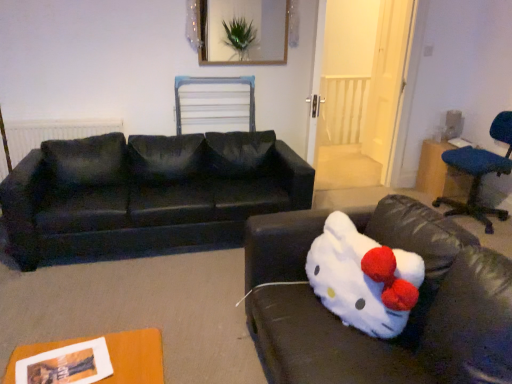
I want to click on blue fabric table at right, so click(440, 173).

Describe the element at coordinates (409, 318) in the screenshot. I see `white plush toy at lower right, the second studio couch in the back-to-front sequence` at that location.

At what (x,y) coordinates should I click in order to perform the action: click on wooden picture frame at upper center. Please return your answer as a coordinate pair (x, y). This screenshot has height=384, width=512. Looking at the image, I should click on (248, 23).

Is white plush toy at lower right beside wooden picture frame at upper center?

white plush toy at lower right and wooden picture frame at upper center are not in contact.

Where is `picture frame above the white plush toy at lower right (from the image's perspective)`? picture frame above the white plush toy at lower right (from the image's perspective) is located at coordinates (248, 23).

Is white plush toy at lower right located outside wooden picture frame at upper center?

Indeed, white plush toy at lower right is completely outside wooden picture frame at upper center.

Is point (404, 281) closer to viewer compared to point (213, 13)?

Yes.

Is matte black radiator at left far from blue fabric table at right?

matte black radiator at left is far away from blue fabric table at right.

Considering the points (35, 133) and (422, 186), which point is in front, point (35, 133) or point (422, 186)?

The point (35, 133) is closer.

Based on the photo, from the image's perspective, is matte black radiator at left located beneath blue fabric table at right?

No, from the image's perspective, matte black radiator at left is not below blue fabric table at right.

How distant is white plush toy at lower right from matte black radiator at left?

A distance of 7.43 feet exists between white plush toy at lower right and matte black radiator at left.

From the image's perspective, is white plush toy at lower right above matte black radiator at left?

Actually, white plush toy at lower right appears below matte black radiator at left in the image.

Looking at this image, is white plush toy at lower right far away from matte black radiator at left?

Absolutely, white plush toy at lower right is distant from matte black radiator at left.

Is white plush toy at lower right to the left or to the right of matte black radiator at left in the image?

From the image, it's evident that white plush toy at lower right is to the right of matte black radiator at left.

Considering the points (342, 290) and (287, 164), which point is behind, point (342, 290) or point (287, 164)?

Positioned behind is point (287, 164).

Locate an element on the screen. This screenshot has width=512, height=384. animal below the black fabric couch at left, the second studio couch viewed from the front (from the image's perspective) is located at coordinates (362, 278).

Between white plush toy at lower right and black fabric couch at left, the first studio couch positioned from the back, which one appears on the left side from the viewer's perspective?

black fabric couch at left, the first studio couch positioned from the back, is more to the left.

How many degrees apart are the facing directions of white plush toy at lower right and black fabric couch at left, the second studio couch viewed from the front?

They differ by 79.7 degrees in their facing directions.

Between white plush toy at lower right, arranged as the 1th studio couch when viewed from the front, and blue fabric table at right, which one has less height?

blue fabric table at right is shorter.

From a real-world perspective, is white plush toy at lower right, arranged as the 1th studio couch when viewed from the front, under blue fabric table at right?

No, from a real-world perspective, white plush toy at lower right, arranged as the 1th studio couch when viewed from the front, is not beneath blue fabric table at right.

Could you tell me if white plush toy at lower right, arranged as the 1th studio couch when viewed from the front, is turned towards blue fabric table at right?

No, white plush toy at lower right, arranged as the 1th studio couch when viewed from the front, is not facing towards blue fabric table at right.

From the image's perspective, is white plush toy at lower right, the second studio couch in the back-to-front sequence, below blue fabric table at right?

Yes.

Does wooden picture frame at upper center have a greater height compared to black fabric couch at left, the second studio couch viewed from the front?

Incorrect, the height of wooden picture frame at upper center is not larger of that of black fabric couch at left, the second studio couch viewed from the front.

From the picture: Based on their positions, is wooden picture frame at upper center located to the left or right of black fabric couch at left, the first studio couch positioned from the back?

Based on their positions, wooden picture frame at upper center is located to the right of black fabric couch at left, the first studio couch positioned from the back.

Who is more distant, wooden picture frame at upper center or black fabric couch at left, the first studio couch positioned from the back?

wooden picture frame at upper center.

From a real-world perspective, who is located lower, wooden picture frame at upper center or black fabric couch at left, the first studio couch positioned from the back?

black fabric couch at left, the first studio couch positioned from the back.

Who is taller, matte black radiator at left or black fabric couch at left, the second studio couch viewed from the front?

With more height is black fabric couch at left, the second studio couch viewed from the front.

Where is `the 2nd studio couch directly beneath the matte black radiator at left (from a real-world perspective)`? The width and height of the screenshot is (512, 384). the 2nd studio couch directly beneath the matte black radiator at left (from a real-world perspective) is located at coordinates (147, 193).

How many degrees apart are the facing directions of matte black radiator at left and black fabric couch at left, the second studio couch viewed from the front?

The angular difference between matte black radiator at left and black fabric couch at left, the second studio couch viewed from the front, is 1.44 degrees.

Is matte black radiator at left not within black fabric couch at left, the first studio couch positioned from the back?

That's correct, matte black radiator at left is outside of black fabric couch at left, the first studio couch positioned from the back.

Locate an element on the screen. The image size is (512, 384). picture frame above the white plush toy at lower right (from a real-world perspective) is located at coordinates (248, 23).

Find the location of a particular element. table that appears on the right of matte black radiator at left is located at coordinates (440, 173).

Which object lies nearer to the anchor point white plush toy at lower right, the second studio couch in the back-to-front sequence, wooden picture frame at upper center or blue fabric chair at right?

blue fabric chair at right is positioned closer to the anchor white plush toy at lower right, the second studio couch in the back-to-front sequence.

Considering their positions, is white plush toy at lower right, the second studio couch in the back-to-front sequence, positioned further to wooden picture frame at upper center than matte black radiator at left?

white plush toy at lower right, the second studio couch in the back-to-front sequence, is positioned further to the anchor wooden picture frame at upper center.

Which object lies further to the anchor point blue fabric chair at right, white plush toy at lower right or blue fabric table at right?

white plush toy at lower right is positioned further to the anchor blue fabric chair at right.

When comparing their distances from white plush toy at lower right, arranged as the 1th studio couch when viewed from the front, does wooden picture frame at upper center or white plush toy at lower right seem further?

wooden picture frame at upper center.

Which object lies nearer to the anchor point wooden picture frame at upper center, white plush toy at lower right or matte black radiator at left?

matte black radiator at left.

Considering their positions, is white plush toy at lower right positioned closer to blue fabric table at right than white plush toy at lower right, arranged as the 1th studio couch when viewed from the front?

Among the two, white plush toy at lower right, arranged as the 1th studio couch when viewed from the front, is located nearer to blue fabric table at right.

When comparing their distances from matte black radiator at left, does black fabric couch at left, the second studio couch viewed from the front, or white plush toy at lower right, arranged as the 1th studio couch when viewed from the front, seem closer?

The object closer to matte black radiator at left is black fabric couch at left, the second studio couch viewed from the front.

Estimate the real-world distances between objects in this image. Which object is closer to white plush toy at lower right, black fabric couch at left, the second studio couch viewed from the front, or white plush toy at lower right, arranged as the 1th studio couch when viewed from the front?

white plush toy at lower right, arranged as the 1th studio couch when viewed from the front, is positioned closer to the anchor white plush toy at lower right.

Where is `picture frame situated between matte black radiator at left and blue fabric table at right from left to right`? The image size is (512, 384). picture frame situated between matte black radiator at left and blue fabric table at right from left to right is located at coordinates (248, 23).

You are a GUI agent. You are given a task and a screenshot of the screen. Output one action in this format:
    pyautogui.click(x=<x>, y=<y>)
    Task: Click on the studio couch between white plush toy at lower right, arranged as the 1th studio couch when viewed from the front, and matte black radiator at left in the front-back direction
    
    Given the screenshot: What is the action you would take?
    pyautogui.click(x=147, y=193)

What are the coordinates of `chair located between white plush toy at lower right and blue fabric table at right in the depth direction` in the screenshot? It's located at (480, 172).

Locate an element on the screen. This screenshot has height=384, width=512. picture frame between white plush toy at lower right and blue fabric table at right from front to back is located at coordinates (248, 23).